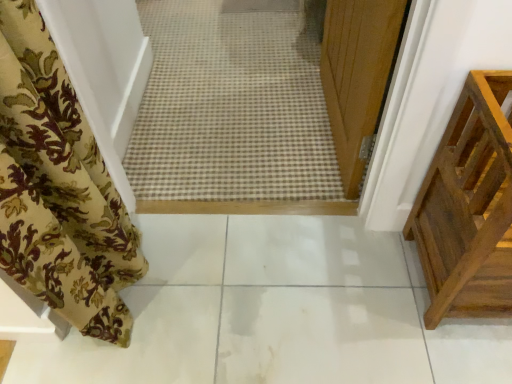
Locate an element on the screen. This screenshot has height=384, width=512. free space in front of floral fabric curtain at left is located at coordinates 136,349.